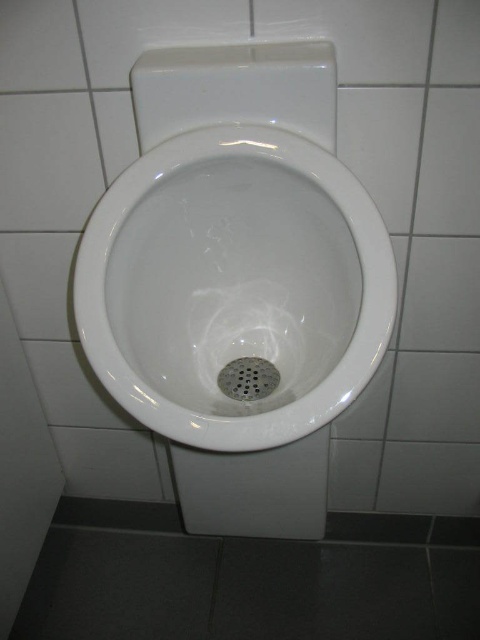
Can you confirm if white glossy toilet bowl at center is positioned above white glossy tile at upper left?

Incorrect, white glossy toilet bowl at center is not positioned above white glossy tile at upper left.

Measure the distance between point (167, 163) and camera.

Point (167, 163) is 28.58 inches from camera.

Between point (216, 259) and point (78, 148), which one is positioned behind?

The point (78, 148) is more distant.

What are the coordinates of `white glossy toilet bowl at center` in the screenshot? It's located at (235, 285).

Does white glossy tile at upper left have a greater height compared to white tile at upper right?

→ In fact, white glossy tile at upper left may be shorter than white tile at upper right.

Does point (9, 156) come behind point (434, 209)?

Yes, it is.

Is point (80, 186) behind point (424, 208)?

Yes, it is behind point (424, 208).

The width and height of the screenshot is (480, 640). Find the location of `white glossy tile at upper left`. white glossy tile at upper left is located at coordinates (48, 161).

Does white glossy toilet bowl at center appear over metallic grid drain at center?

Indeed, white glossy toilet bowl at center is positioned over metallic grid drain at center.

Does point (203, 138) lie behind point (233, 390)?

No, (203, 138) is in front of (233, 390).

The height and width of the screenshot is (640, 480). I want to click on white glossy toilet bowl at center, so click(235, 285).

Identify the location of white glossy toilet bowl at center. This screenshot has width=480, height=640. (235, 285).